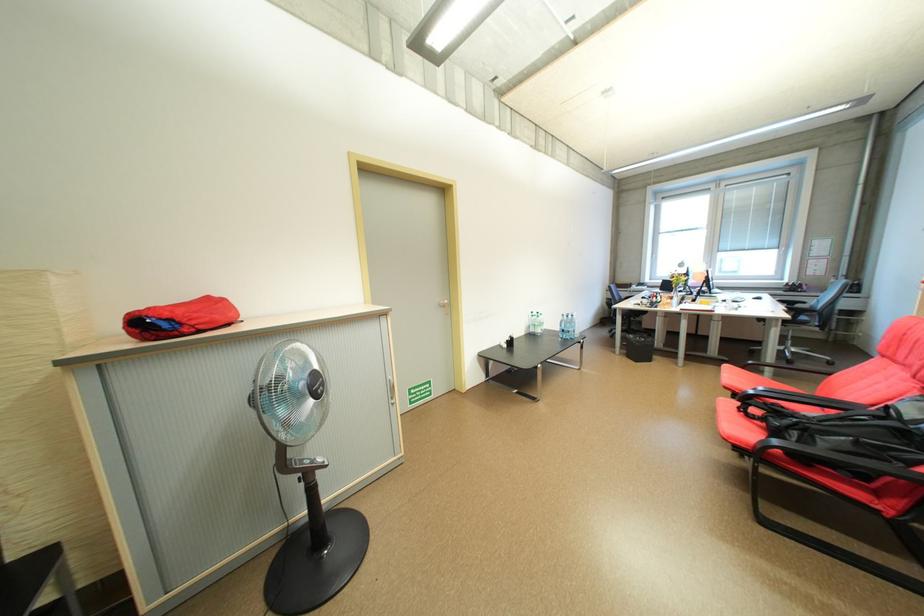
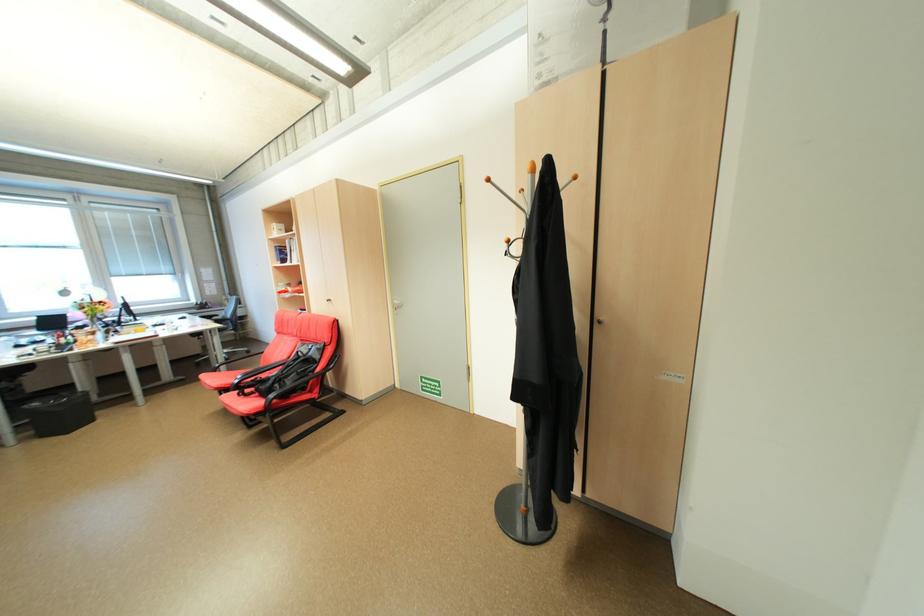
Locate, in the second image, the point that corresponds to (x=840, y=363) in the first image.

(257, 353)